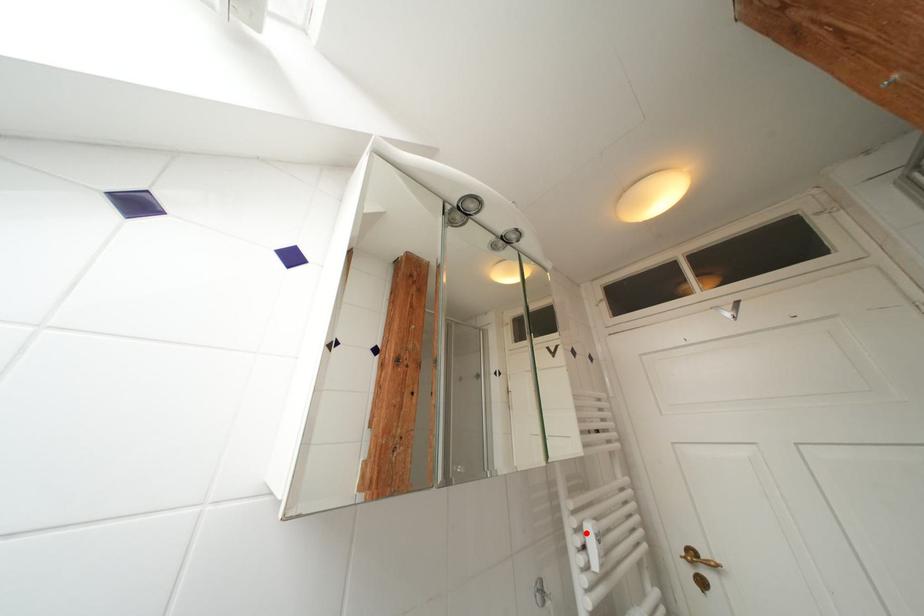
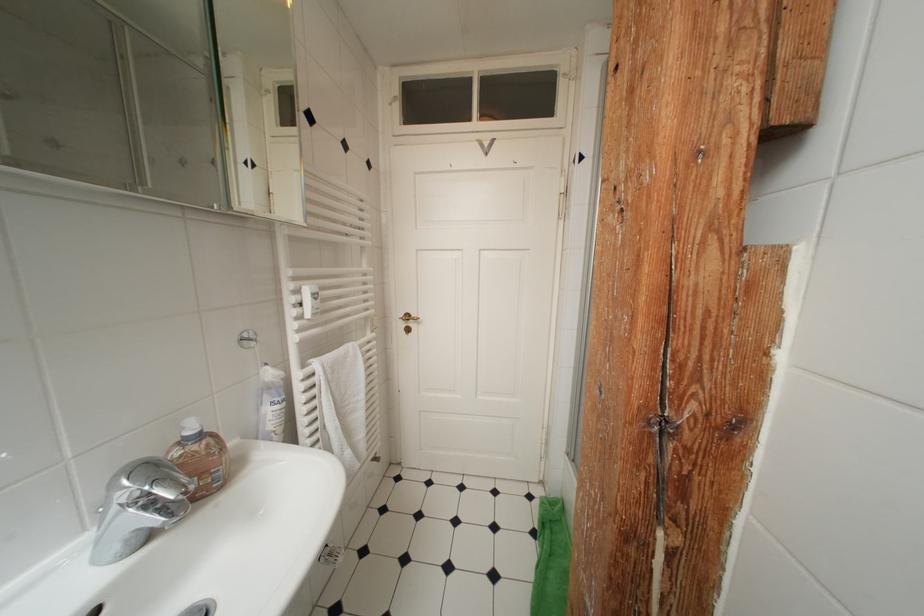
In the second image, find the point that corresponds to the highlighted location in the first image.

(304, 294)